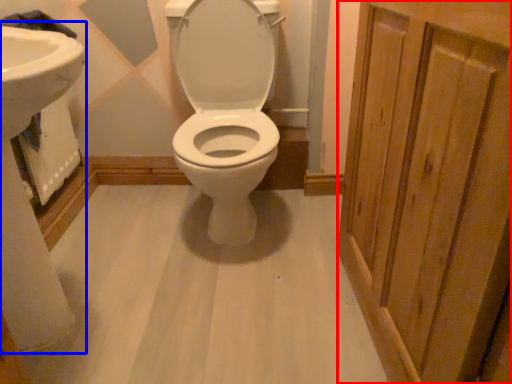
Question: Which object is further to the camera taking this photo, screen door (highlighted by a red box) or sink (highlighted by a blue box)?

Choices:
 (A) screen door
 (B) sink

Answer: (B)